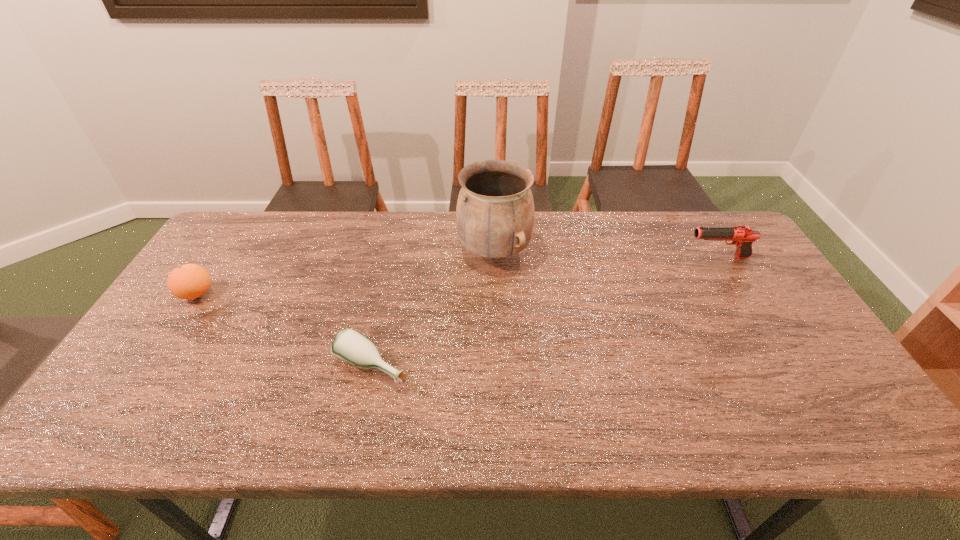
This screenshot has width=960, height=540. Identify the location of free space at the near edge. pyautogui.click(x=256, y=410).

Find the location of a particular element. The width and height of the screenshot is (960, 540). vacant space at the left edge is located at coordinates (160, 376).

In the image, there is a desktop. Where is `blank space at the right edge`? blank space at the right edge is located at coordinates (728, 291).

I want to click on vacant space at the far left corner, so click(x=231, y=220).

Where is `free region at the near left corner of the desktop`? free region at the near left corner of the desktop is located at coordinates (x=158, y=418).

Locate an element on the screen. free space between the third shortest object and the orange is located at coordinates (457, 276).

Locate an element on the screen. The height and width of the screenshot is (540, 960). free space between the nearest object and the second object from right to left is located at coordinates (433, 309).

The height and width of the screenshot is (540, 960). What are the coordinates of `vacant region between the orange and the second object from left to right` in the screenshot? It's located at (285, 330).

Image resolution: width=960 pixels, height=540 pixels. I want to click on vacant point located between the second object from right to left and the second shortest object, so click(x=346, y=273).

Where is `free spot between the third object from right to left and the orange`? free spot between the third object from right to left and the orange is located at coordinates (285, 330).